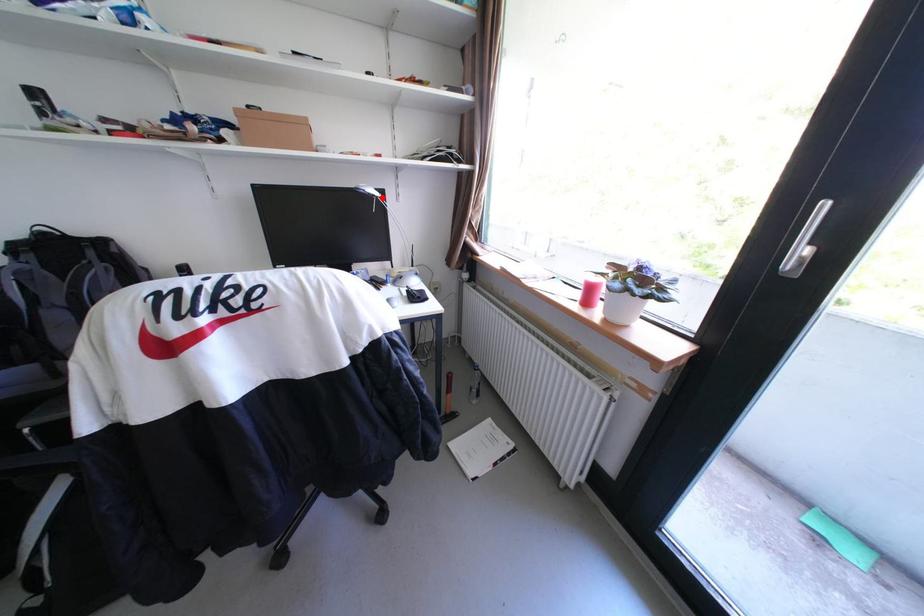
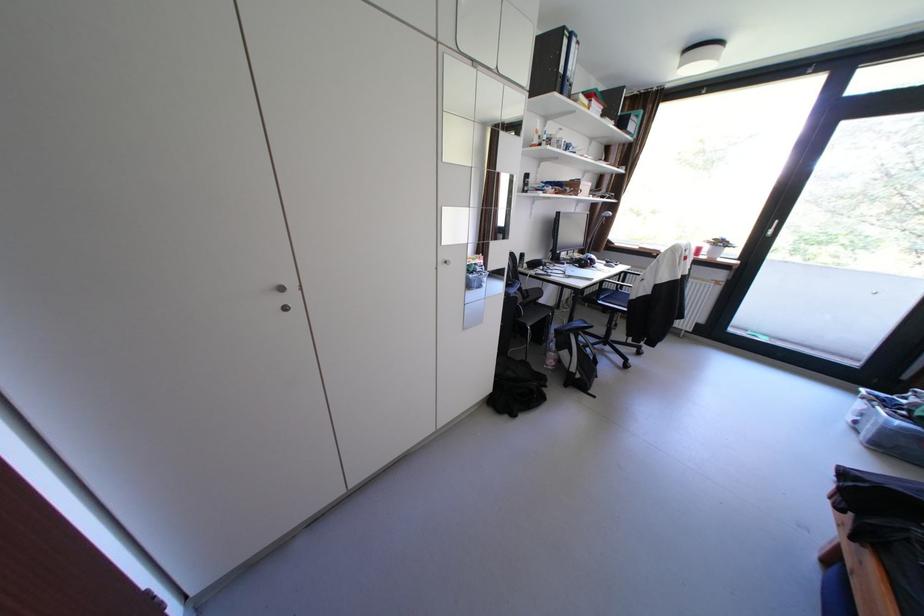
Question: I am providing you with two images of the same scene from different viewpoints. In image1, a red point is highlighted. Considering the same 3D point in image2, which of the following is correct?

Choices:
 (A) It is closer
 (B) It is farther

Answer: (A)